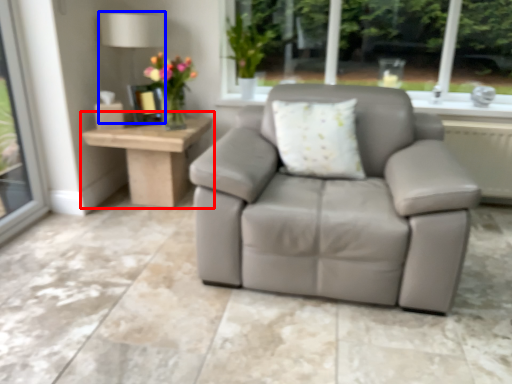
Question: Which object appears closest to the camera in this image, table (highlighted by a red box) or lamp (highlighted by a blue box)?

Choices:
 (A) table
 (B) lamp

Answer: (A)